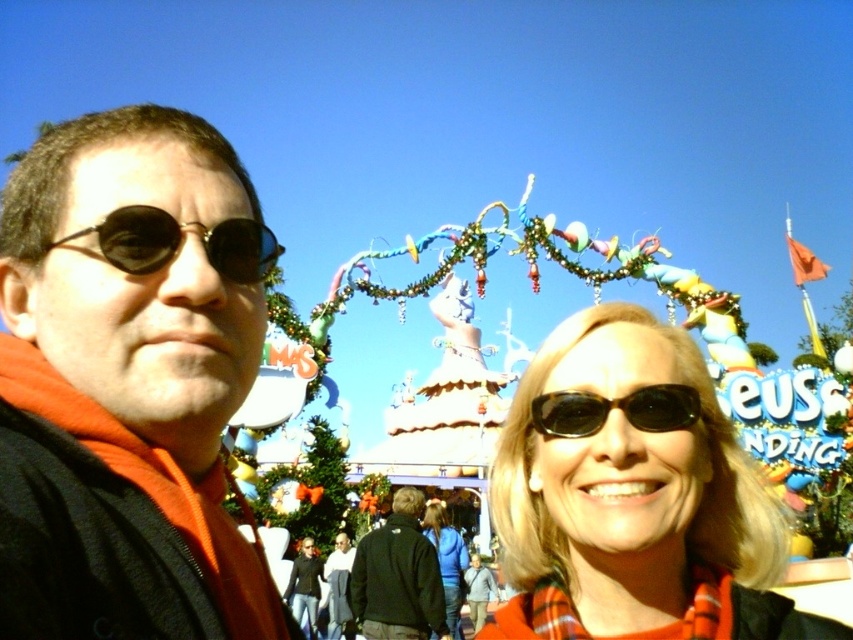
Which is more to the left, dark blue jacket at center or black matte sunglasses at left?

Positioned to the left is black matte sunglasses at left.

Can you confirm if dark blue jacket at center is shorter than black matte sunglasses at left?

No.

Who is more distant from viewer, (440, 605) or (267, 246)?

The point (440, 605) is more distant.

I want to click on dark blue jacket at center, so click(x=399, y=577).

Can you confirm if decorative plastic archway at center is wider than black matte sunglasses at left?

Correct, the width of decorative plastic archway at center exceeds that of black matte sunglasses at left.

Which is in front, point (663, 452) or point (155, 214)?

Positioned in front is point (155, 214).

The width and height of the screenshot is (853, 640). In order to click on decorative plastic archway at center in this screenshot , I will do [x=634, y=502].

Measure the distance between black matte sunglasses at left and blue fabric jacket at center.

The distance of black matte sunglasses at left from blue fabric jacket at center is 189.68 feet.

Who is higher up, black matte sunglasses at left or blue fabric jacket at center?

black matte sunglasses at left is higher up.

Where is `black matte sunglasses at left`? The image size is (853, 640). black matte sunglasses at left is located at coordinates (180, 243).